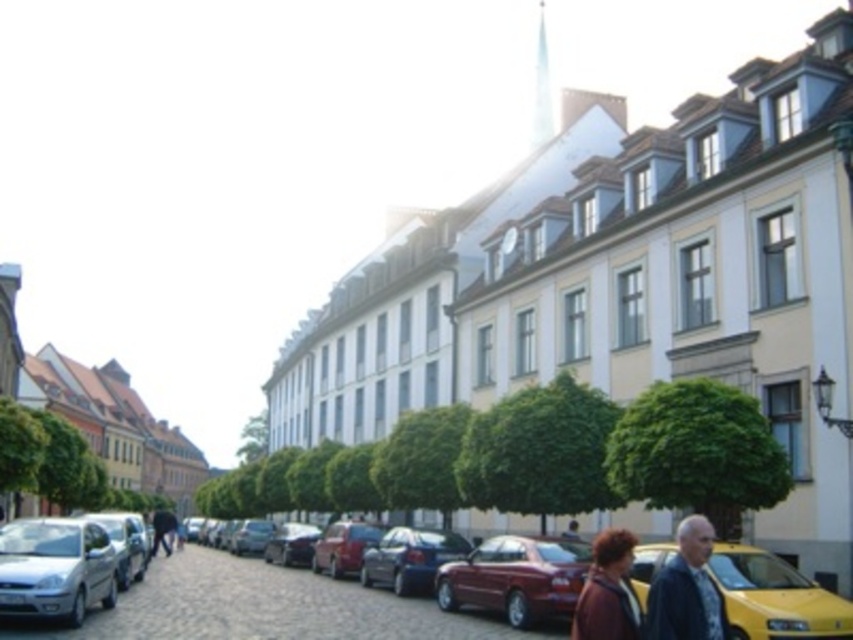
You are a delivery driver who needs to park your car in this street scene. The parking spot you want is at coordinate point 0.889, 0.066. Is the silver metallic car at lower left currently occupying that spot?

The silver metallic car at lower left is positioned at point (x=55, y=568), so yes, it is occupying the parking spot you want.

You are a delivery person trying to park your van, which is 1.8 meters tall, in this street. You notice the silver metallic car at lower left and the metallic red car at center. Which car is taller, and will your van fit between them vertically?

The silver metallic car at lower left is taller than the metallic red car at center. Since the van is 1.8 meters tall and the silver metallic car at lower left is taller than the metallic red car at center, the van may not fit between them vertically if the space is constrained by the taller car.

You are standing on the street and want to walk from the point at coordinates point (15, 532) to the point at coordinates point (354, 568). Which direction should you face to move towards the second point?

You should face away from the viewer because point (354, 568) is further away than point (15, 532).